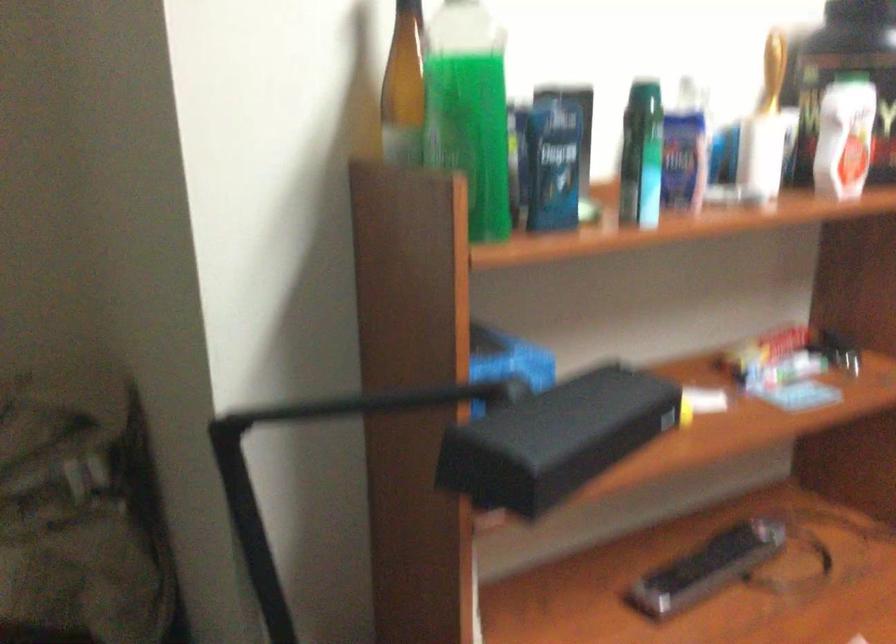
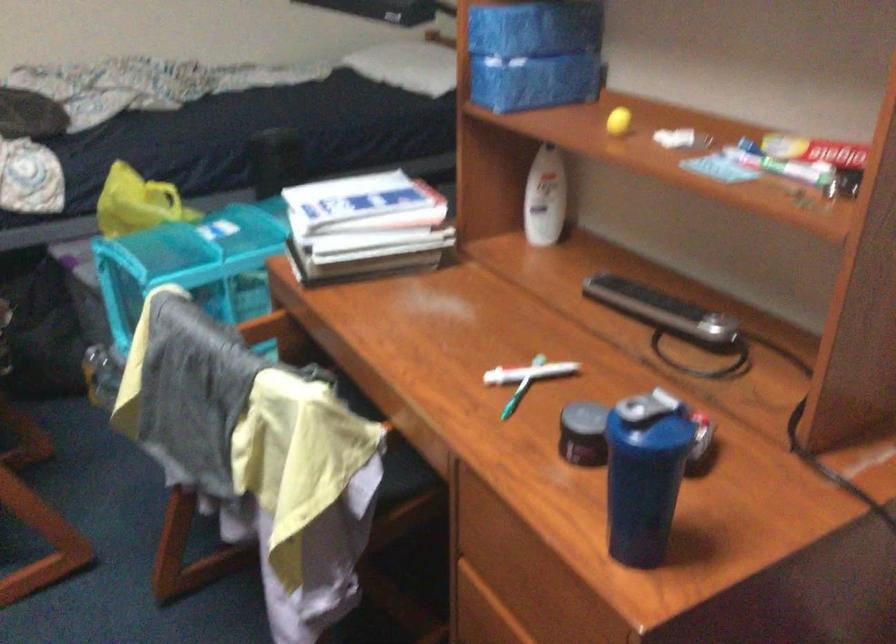
Where in the second image is the point corresponding to [729,559] from the first image?

(661, 308)